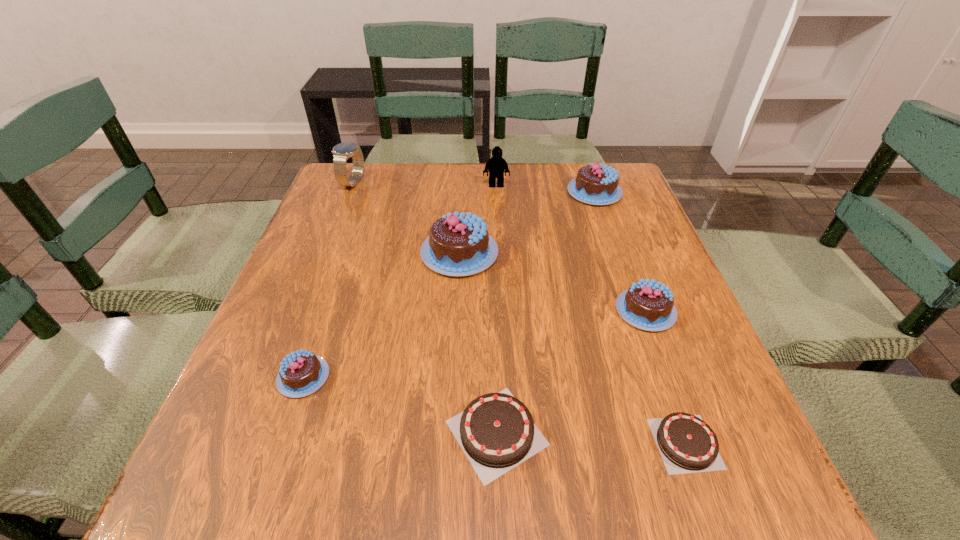
Identify the location of vacant space located 0.220m on the back of the bigger brown chocolate cake. The image size is (960, 540). (492, 296).

Find the location of `vacant space located on the back of the shortest chocolate cake`. vacant space located on the back of the shortest chocolate cake is located at coordinates (630, 287).

The height and width of the screenshot is (540, 960). Find the location of `Lego present at the far edge`. Lego present at the far edge is located at coordinates (496, 166).

The width and height of the screenshot is (960, 540). Find the location of `watch that is at the far edge`. watch that is at the far edge is located at coordinates 341,152.

Find the location of `chocolate cake that is positioned at the far edge`. chocolate cake that is positioned at the far edge is located at coordinates (597, 184).

The image size is (960, 540). In order to click on watch that is at the left edge in this screenshot , I will do `click(341, 152)`.

Locate an element on the screen. Image resolution: width=960 pixels, height=540 pixels. chocolate cake that is positioned at the left edge is located at coordinates (301, 373).

This screenshot has width=960, height=540. I want to click on object that is at the far left corner, so click(x=341, y=152).

Image resolution: width=960 pixels, height=540 pixels. I want to click on object located at the far right corner, so click(x=597, y=184).

Where is `object present at the near right corner`? object present at the near right corner is located at coordinates (687, 444).